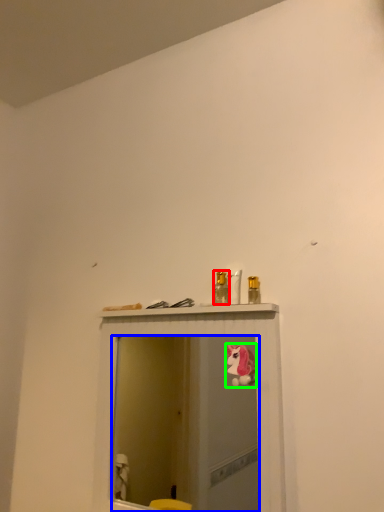
Question: Based on their relative distances, which object is farther from toiletry (highlighted by a red box)? Choose from mirror (highlighted by a blue box) and animal (highlighted by a green box).

Choices:
 (A) mirror
 (B) animal

Answer: (A)